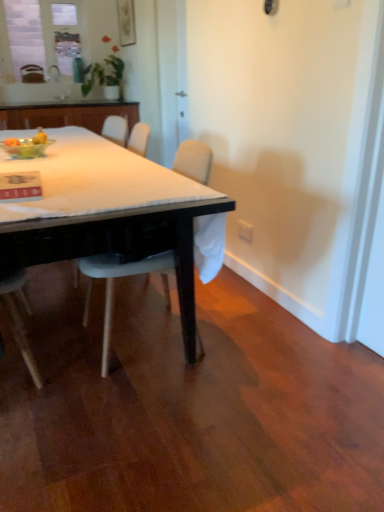
Identify the location of free area behind white plastic chair at center, marked as the 2th chair in a back-to-front arrangement. (155, 294).